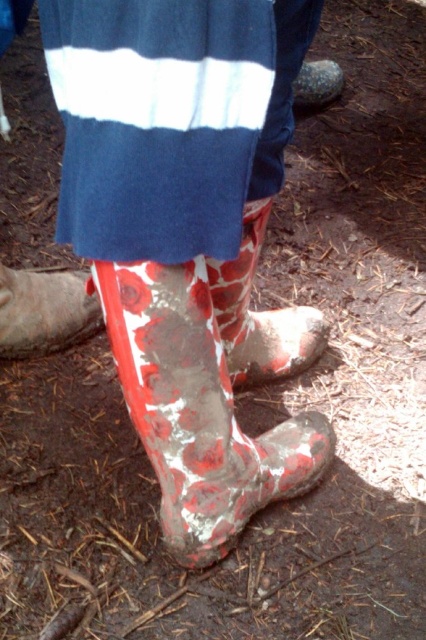
Can you confirm if matte rubber boot at lower left is positioned above shiny metallic rock at upper center?

Incorrect, matte rubber boot at lower left is not positioned above shiny metallic rock at upper center.

Who is more forward, (83, 300) or (339, 77)?

Point (83, 300) is in front.

Locate an element on the screen. The image size is (426, 640). matte rubber boot at lower left is located at coordinates (43, 310).

What are the coordinates of `matte rubber boot at lower left` in the screenshot? It's located at (43, 310).

Is point (227, 512) more distant than point (80, 337)?

No, (227, 512) is closer to viewer.

Which of these two, rubber boot at lower center or matte rubber boot at lower left, stands shorter?

matte rubber boot at lower left

Who is more forward, (192, 310) or (2, 266)?

Point (192, 310) is in front.

Where is `rubber boot at lower center`? rubber boot at lower center is located at coordinates (198, 410).

Is reddish matte rubber boot at lower center bigger than matte rubber boot at lower left?

Yes.

Does reddish matte rubber boot at lower center appear on the left side of matte rubber boot at lower left?

Incorrect, reddish matte rubber boot at lower center is not on the left side of matte rubber boot at lower left.

Who is more forward, (250, 378) or (58, 307)?

Point (250, 378)

The image size is (426, 640). Identify the location of reddish matte rubber boot at lower center. (259, 314).